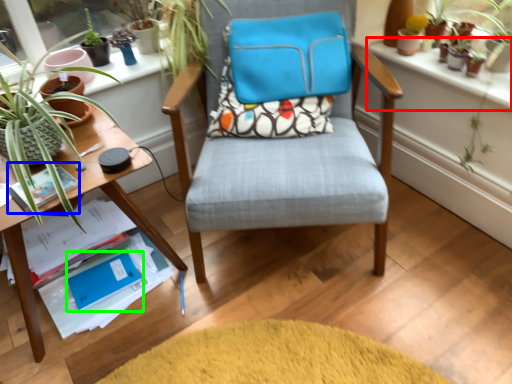
Question: Considering the real-world distances, which object is farthest from window sill (highlighted by a red box)? paperback book (highlighted by a blue box) or paperback book (highlighted by a green box)?

Choices:
 (A) paperback book
 (B) paperback book

Answer: (B)